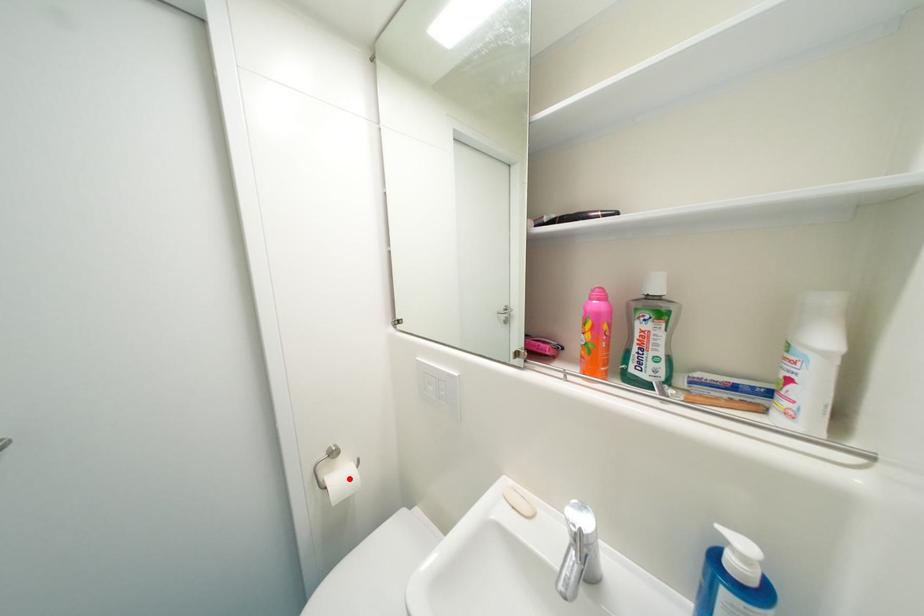
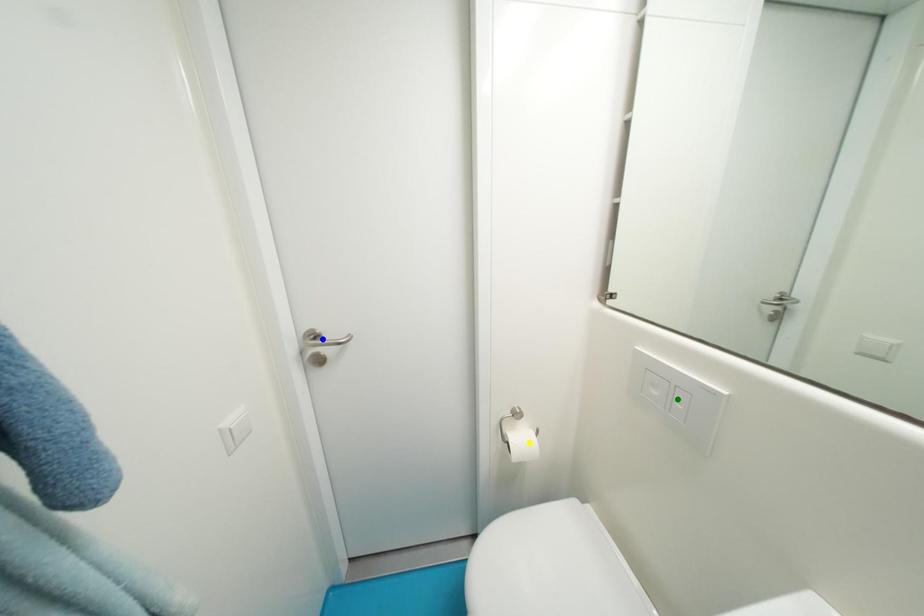
Question: I am providing you with two images of the same scene from different viewpoints. A red point is marked on the first image. You are given multiple points on the second image. Can you choose the point in image 2 that corresponds to the point in image 1?

Choices:
 (A) blue point
 (B) green point
 (C) yellow point

Answer: (C)